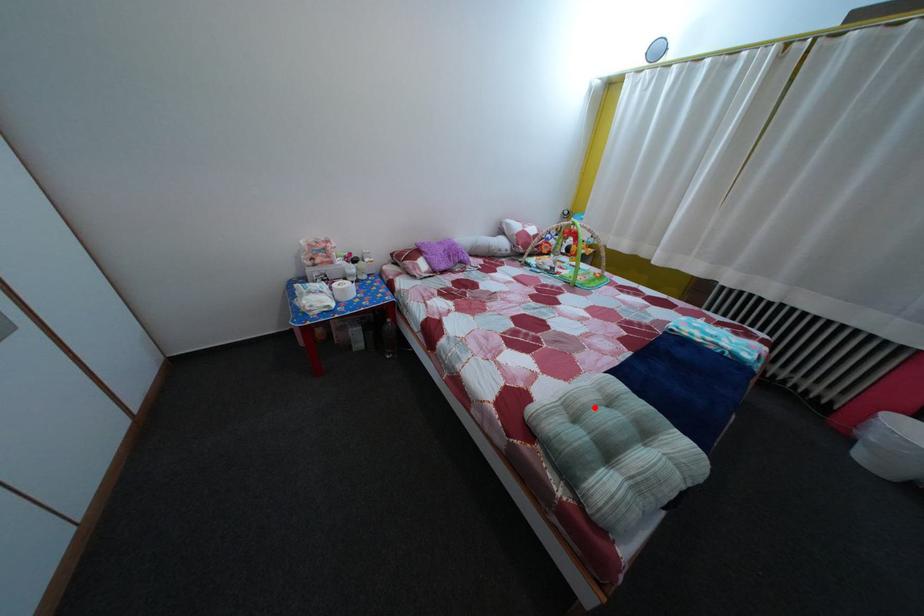
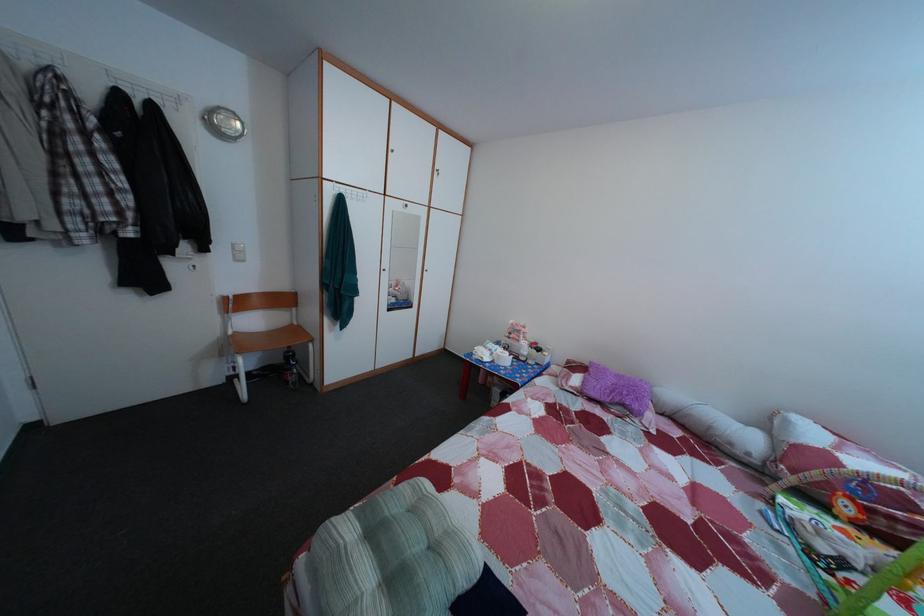
Find the pixel in the second image that matches the highlighted location in the first image.

(440, 521)